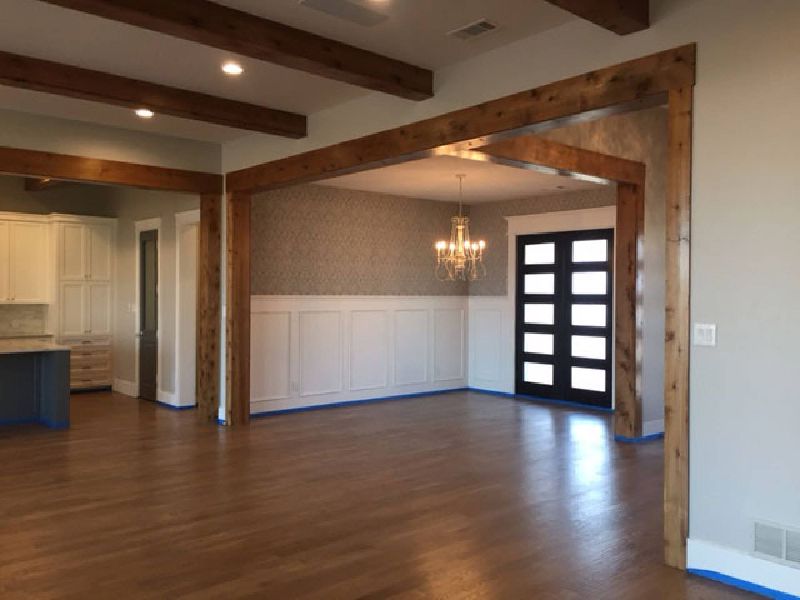
Identify the location of light source. Image resolution: width=800 pixels, height=600 pixels. (232, 68), (142, 111), (437, 244).